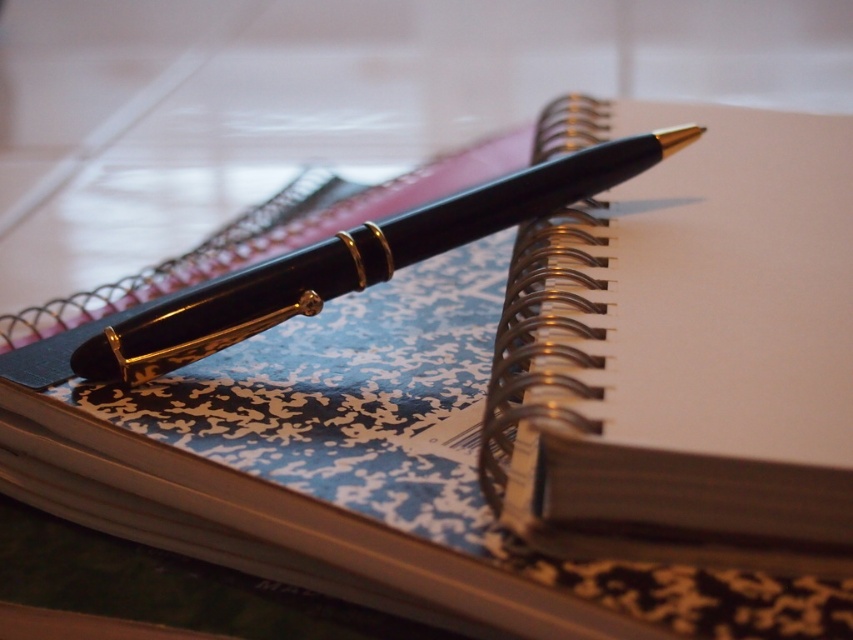
You are organizing your desk and need to place both the matte black notepad at upper right and the matte black pen at center into a drawer. The drawer has a divider that separates items into left and right sections. If you want to keep them in the same relative positions as shown in the image, which object should go on the left side of the drawer?

The matte black pen at center should be placed on the left side of the drawer because in the image, the matte black notepad at upper right is to the right of the matte black pen at center, meaning the pen is already positioned to the left of the notepad.

You are organizing a desk and need to place the matte black notepad at upper right and the matte black pen at center. If you move the notepad closer to you, will the pen become more visible or less visible?

The matte black notepad at upper right is in front of the matte black pen at center. Moving the notepad closer to you would bring it further between you and the pen, making the pen less visible.